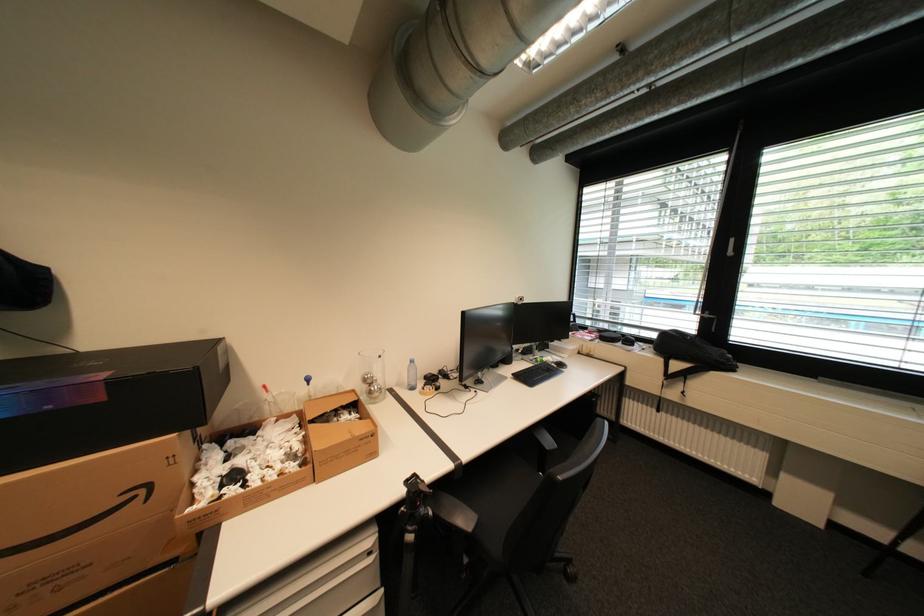
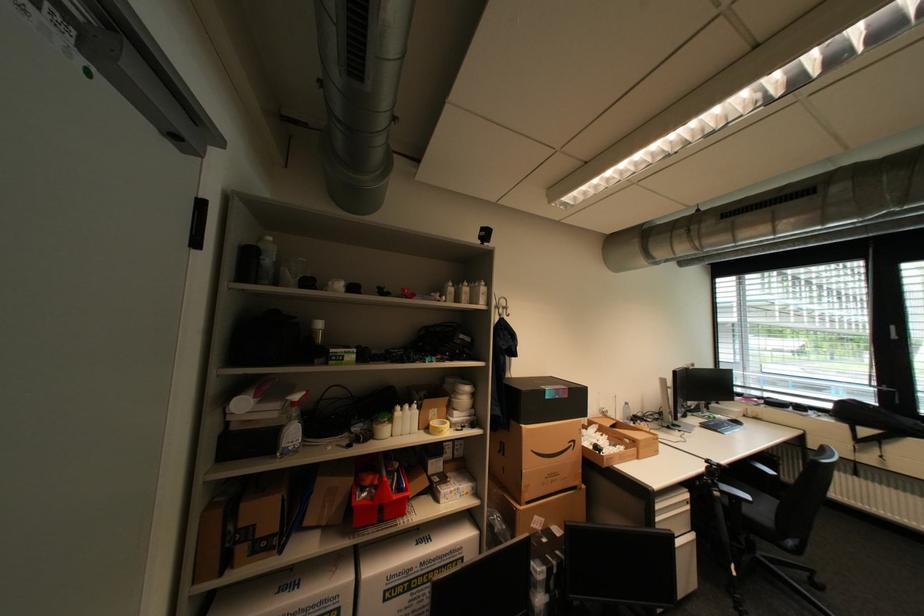
What movement of the cameraman would produce the second image?

The cameraman walked toward left, backward.